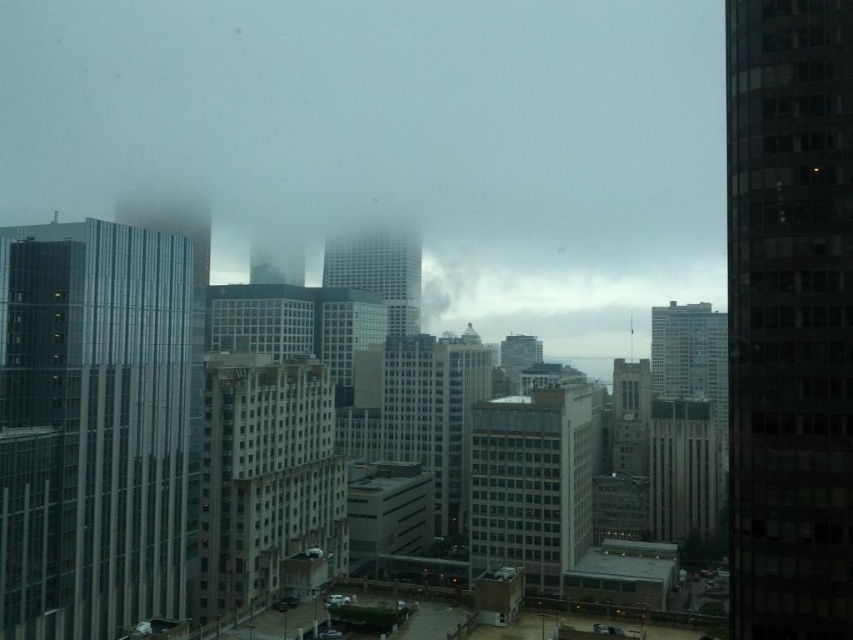
Question: Which is farther from the gray concrete building at center?

Choices:
 (A) dark glass skyscraper at right
 (B) glassy reflective skyscraper at center
 (C) white fluffy cloud at center

Answer: (C)

Question: Estimate the real-world distances between objects in this image. Which object is closer to the dark glass skyscraper at right?

Choices:
 (A) glassy reflective skyscraper at left
 (B) glassy reflective skyscraper at center
 (C) light beige stone building at center
 (D) gray concrete building at center

Answer: (A)

Question: Is glassy reflective skyscraper at left above glassy reflective skyscraper at center?

Choices:
 (A) yes
 (B) no

Answer: (B)

Question: Which of these objects is positioned farthest from the dark glass skyscraper at right?

Choices:
 (A) glassy reflective skyscraper at left
 (B) glassy reflective skyscraper at center

Answer: (B)

Question: Can you confirm if light beige stone building at center is positioned to the left of white fluffy cloud at center?

Choices:
 (A) no
 (B) yes

Answer: (B)

Question: Is gray concrete building at center below white fluffy cloud at center?

Choices:
 (A) no
 (B) yes

Answer: (B)